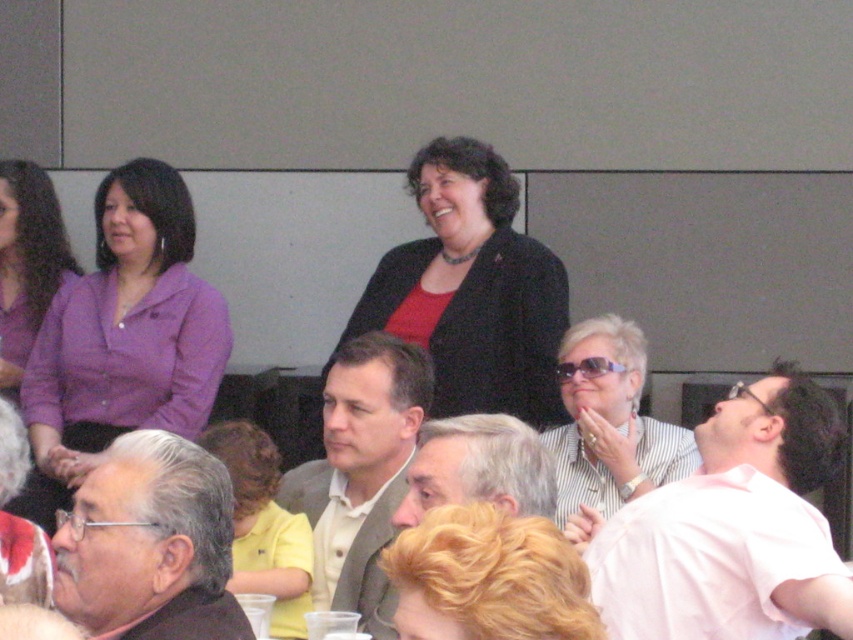
Question: Which point appears farthest from the camera in this image?

Choices:
 (A) (396, 528)
 (B) (160, 221)

Answer: (B)

Question: Can you confirm if striped fabric shirt at center is thinner than yellow matte shirt at center?

Choices:
 (A) yes
 (B) no

Answer: (B)

Question: Which is farther from the yellow matte shirt at center?

Choices:
 (A) light brown textured blazer at center
 (B) matte black blazer at center

Answer: (B)

Question: Does matte black blazer at center appear under striped fabric shirt at center?

Choices:
 (A) no
 (B) yes

Answer: (A)

Question: Among these points, which one is farthest from the camera?

Choices:
 (A) (129, 278)
 (B) (219, 483)

Answer: (A)

Question: Can you confirm if matte black blazer at center is positioned to the left of matte purple sweater at upper left?

Choices:
 (A) no
 (B) yes

Answer: (A)